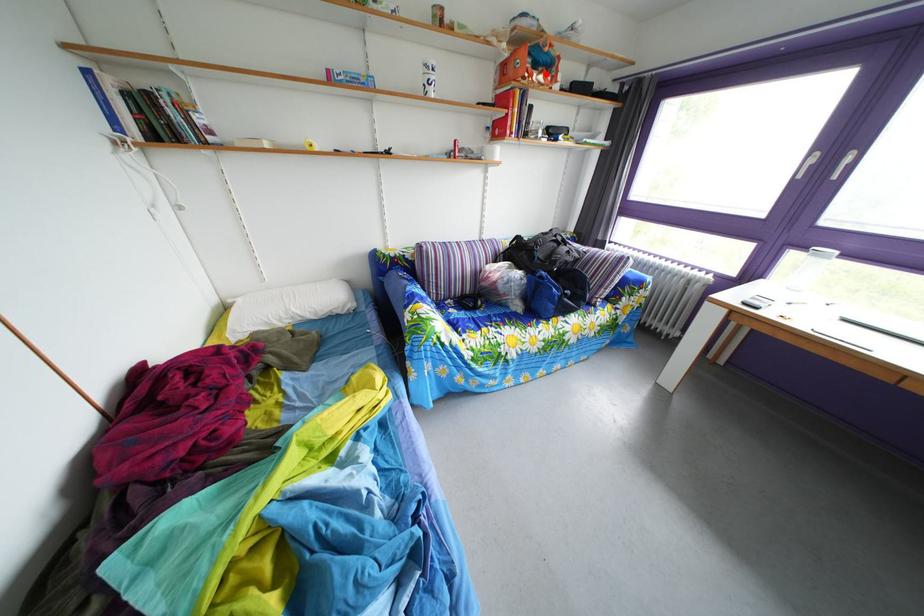
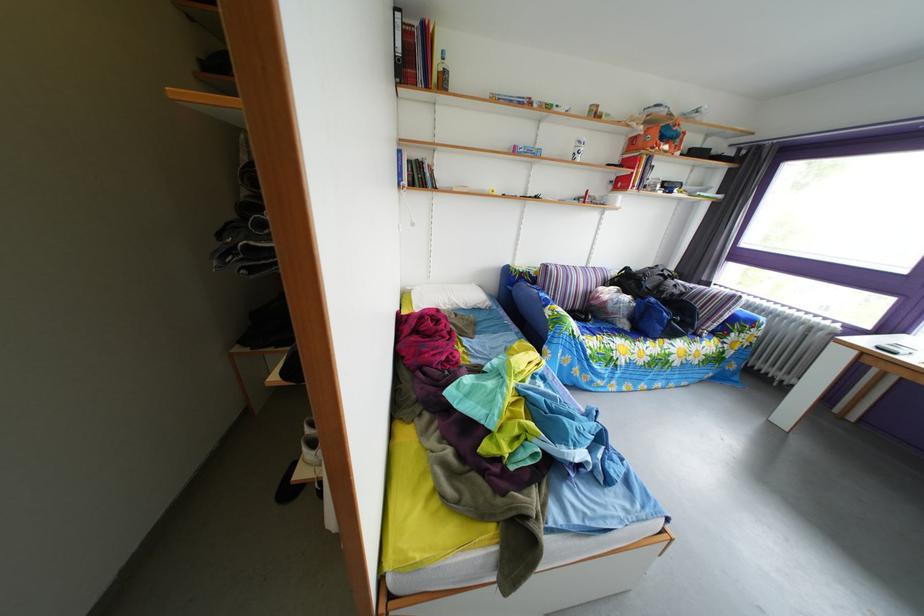
The point at the highlighted location is marked in the first image. Where is the corresponding point in the second image?

(673, 147)